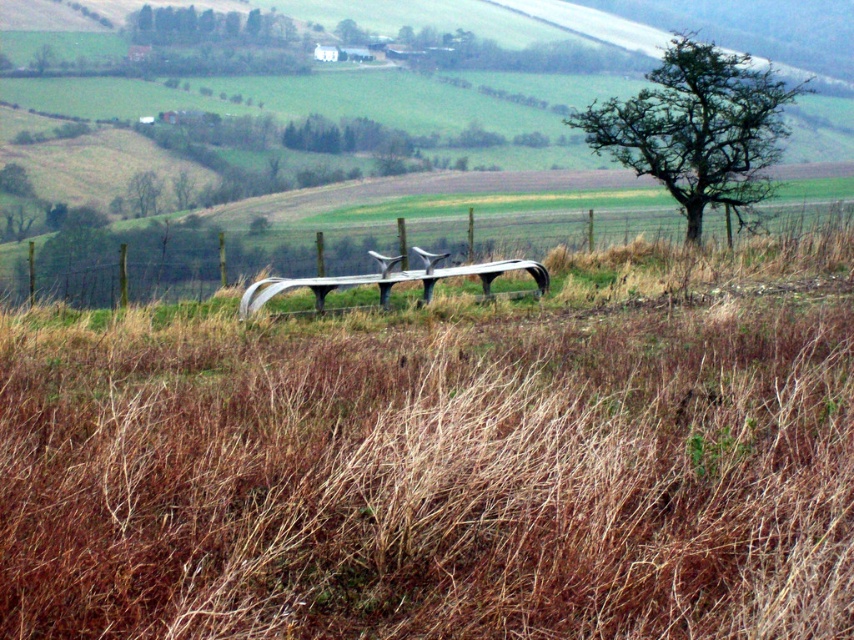
You are standing at the point marked as point (610, 280) and want to walk towards the point marked as point (151, 200). Considering the scene described, will you be moving towards the foreground or the background?

You will be moving towards the background because point (610, 280) is closer to the camera than point (151, 200), so moving from the closer point to the farther one means heading towards the background.

Based on the scene description, where is the green leafy tree at upper right located in terms of its 2D coordinates?

The green leafy tree at upper right is located at the 2D coordinates of point (697, 129).

You are standing in the rural landscape and want to walk from the curved bench to the metal wire fence at center. Which direction should you head relative to the green leafy tree at center?

You should head to the right of the green leafy tree at center because the metal wire fence at center is located to the right of it.